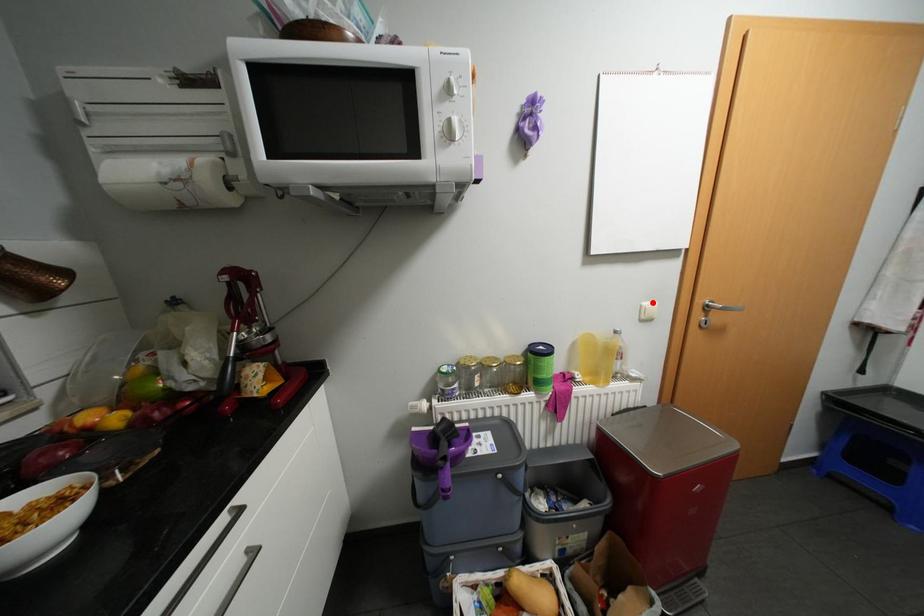
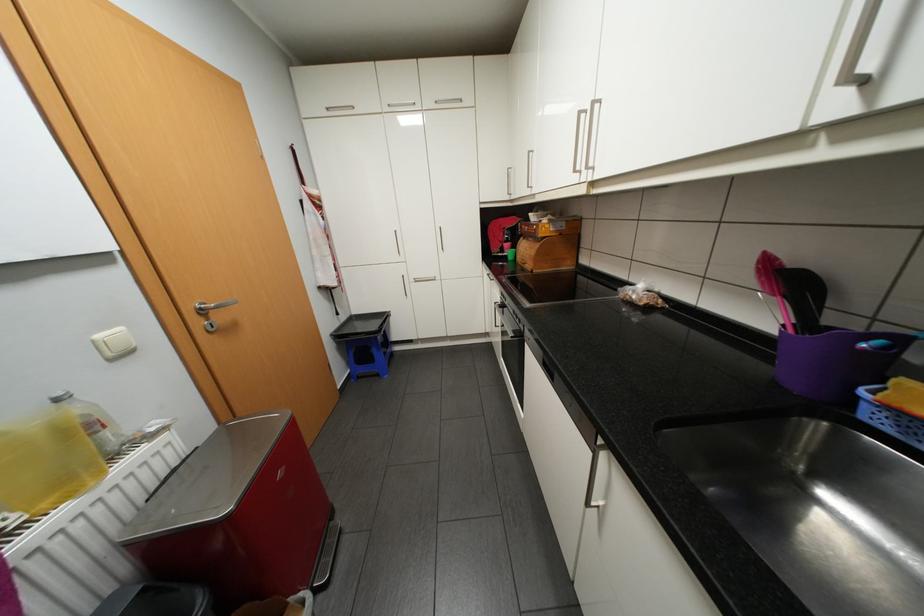
The point at the highlighted location is marked in the first image. Where is the corresponding point in the second image?

(106, 334)